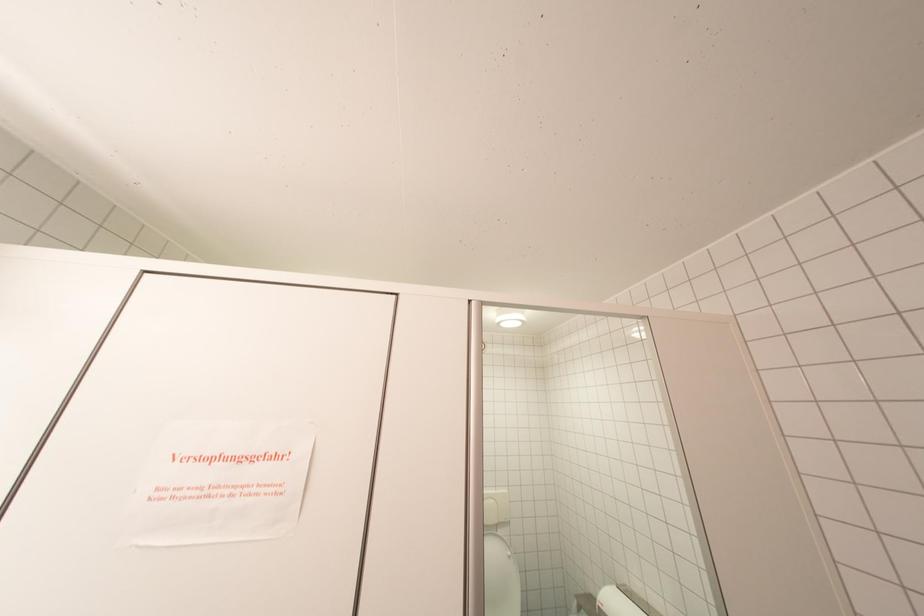
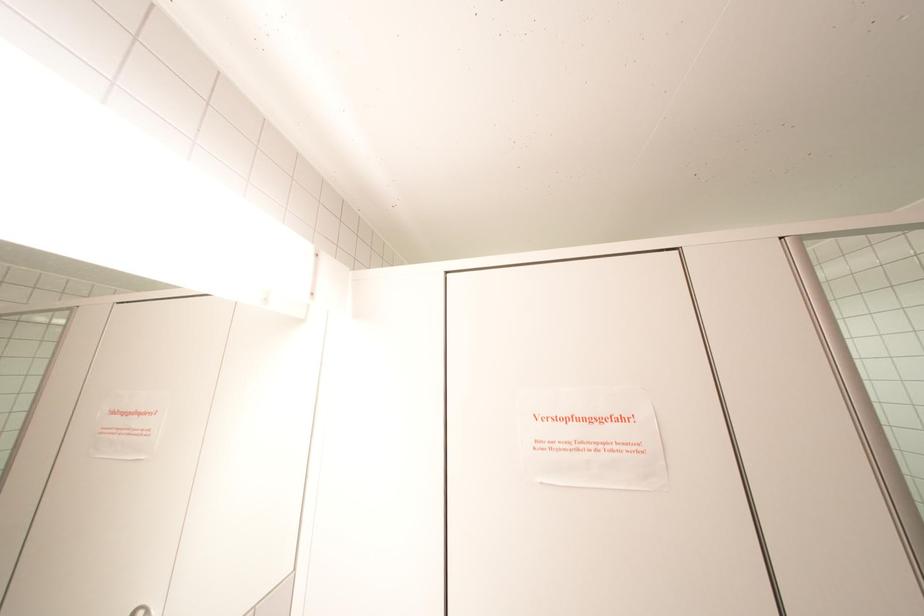
Question: How did the camera likely rotate?

Choices:
 (A) Left
 (B) Right
 (C) Up
 (D) Down

Answer: (A)